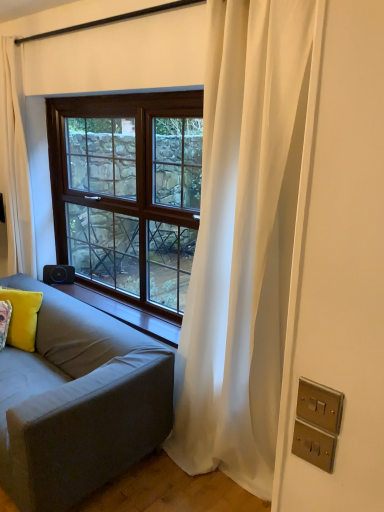
Question: Considering the relative sizes of satin brass switchplate at lower right, marked as the second electric outlet in a bottom-to-top arrangement, and white sheer curtain at right, which appears as the 2th curtain when viewed from the back, in the image provided, is satin brass switchplate at lower right, marked as the second electric outlet in a bottom-to-top arrangement, taller than white sheer curtain at right, which appears as the 2th curtain when viewed from the back,?

Choices:
 (A) yes
 (B) no

Answer: (B)

Question: Considering the relative sizes of satin brass switchplate at lower right, marked as the second electric outlet in a bottom-to-top arrangement, and white sheer curtain at right, which appears as the 2th curtain when viewed from the back, in the image provided, is satin brass switchplate at lower right, marked as the second electric outlet in a bottom-to-top arrangement, smaller than white sheer curtain at right, which appears as the 2th curtain when viewed from the back,?

Choices:
 (A) yes
 (B) no

Answer: (A)

Question: Would you say satin brass switchplate at lower right, marked as the second electric outlet in a bottom-to-top arrangement, is a long distance from white sheer curtain at right, which appears as the 2th curtain when viewed from the back?

Choices:
 (A) yes
 (B) no

Answer: (A)

Question: From a real-world perspective, is satin brass switchplate at lower right, the 1th electric outlet from the top, below white sheer curtain at right, which is the 1th curtain from right to left?

Choices:
 (A) no
 (B) yes

Answer: (A)

Question: Is satin brass switchplate at lower right, the 1th electric outlet from the top, at the left side of white sheer curtain at right, which is the 1th curtain from right to left?

Choices:
 (A) yes
 (B) no

Answer: (B)

Question: From a real-world perspective, does satin brass switchplate at lower right, marked as the second electric outlet in a bottom-to-top arrangement, stand above white sheer curtain at right, positioned as the 1th curtain in front-to-back order?

Choices:
 (A) no
 (B) yes

Answer: (B)

Question: Can you confirm if yellow velvet pillow at lower left is wider than satin gold switchplate at lower right, which is the 1th electric outlet from bottom to top?

Choices:
 (A) no
 (B) yes

Answer: (B)

Question: From a real-world perspective, is yellow velvet pillow at lower left physically below satin gold switchplate at lower right, which is the 1th electric outlet from bottom to top?

Choices:
 (A) no
 (B) yes

Answer: (B)

Question: Is there a large distance between yellow velvet pillow at lower left and satin gold switchplate at lower right, which is the 1th electric outlet from bottom to top?

Choices:
 (A) yes
 (B) no

Answer: (A)

Question: Does yellow velvet pillow at lower left have a larger size compared to satin gold switchplate at lower right, which ranks as the 2th electric outlet in top-to-bottom order?

Choices:
 (A) no
 (B) yes

Answer: (B)

Question: Can you confirm if yellow velvet pillow at lower left is shorter than satin gold switchplate at lower right, which ranks as the 2th electric outlet in top-to-bottom order?

Choices:
 (A) no
 (B) yes

Answer: (A)

Question: Would you say yellow velvet pillow at lower left is outside satin gold switchplate at lower right, which ranks as the 2th electric outlet in top-to-bottom order?

Choices:
 (A) no
 (B) yes

Answer: (B)

Question: Is white sheer curtain at right, the 2th curtain when ordered from left to right, thinner than black plastic speaker at lower left?

Choices:
 (A) no
 (B) yes

Answer: (A)